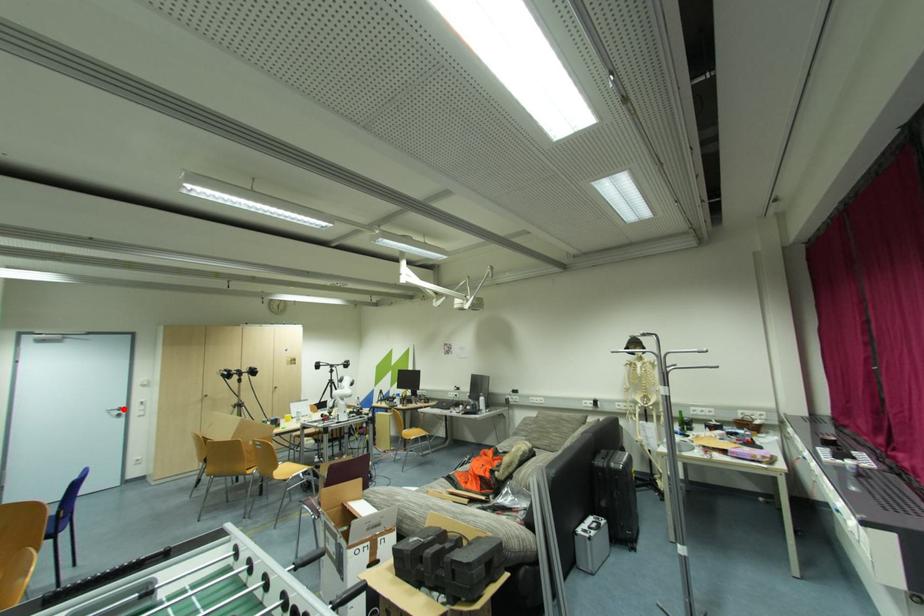
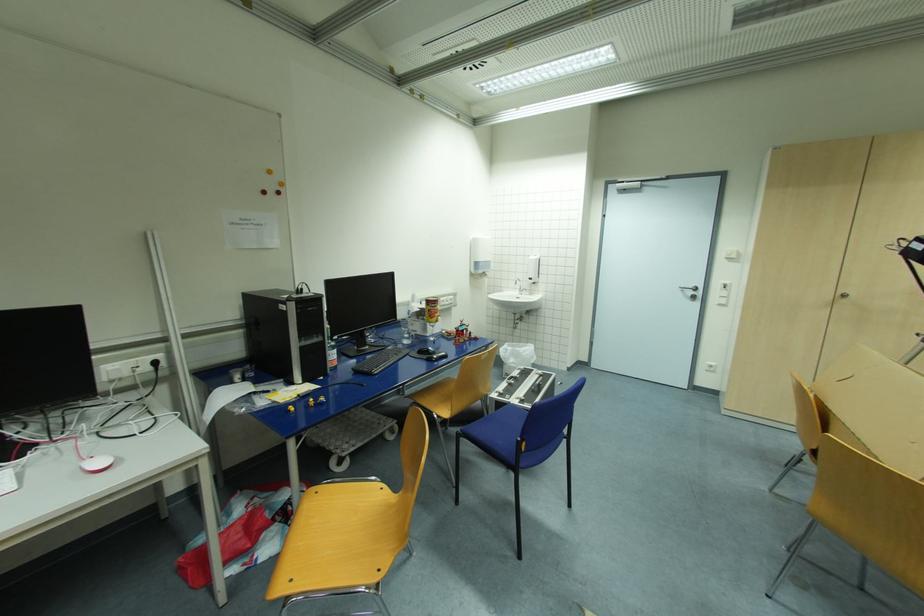
In the second image, find the point that corresponds to the highlighted location in the first image.

(699, 289)